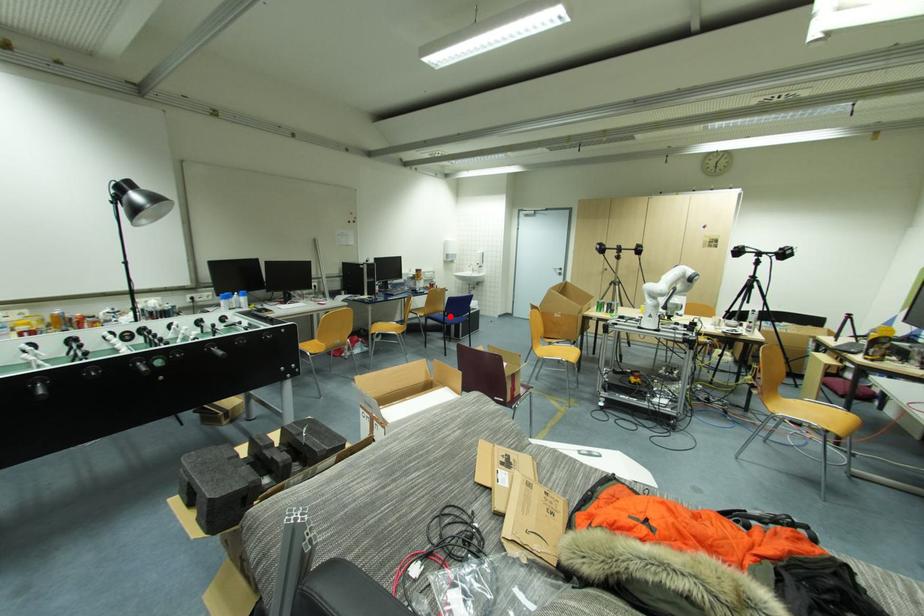
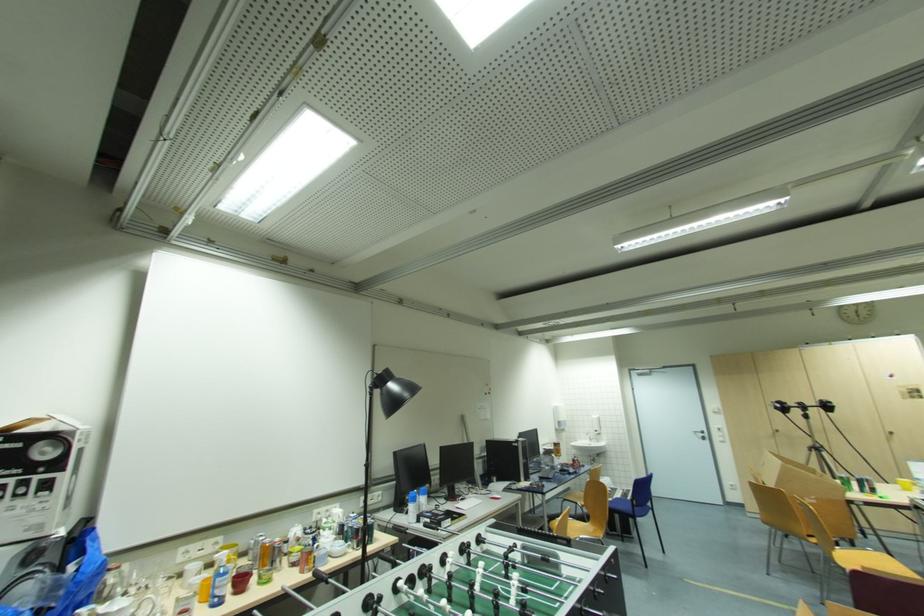
Question: I am providing you with two images of the same scene from different viewpoints. In image1, a red point is highlighted. Considering the same 3D point in image2, which of the following is correct?

Choices:
 (A) It is closer
 (B) It is farther

Answer: (A)